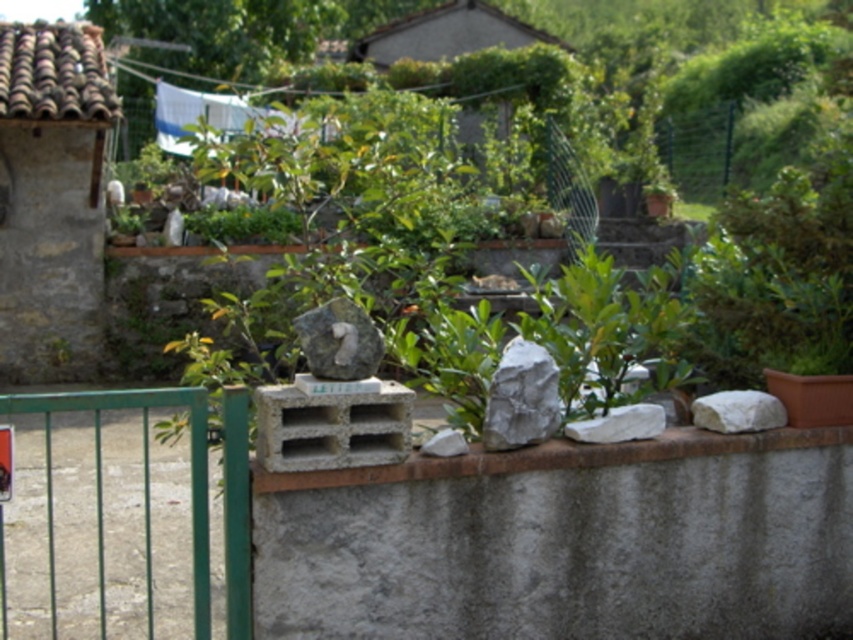
You are designing a garden path and need to place two white smooth rocks. The white smooth rock at right and the white smooth rock at center are available. Which rock should you choose if you want the larger one for a focal point?

The white smooth rock at right is larger compared to the white smooth rock at center, so it should be chosen as the focal point.

You are standing in the garden and see the gray concrete crate at center and the white matte rock at center. Which object is located to the right of the other?

The gray concrete crate at center is positioned on the left side of white matte rock at center, so the white matte rock at center is to the right of the gray concrete crate at center.

You are a gardener trying to place a new plant in the center of this garden area. You have two options for placement spots based on the image. The first spot is near the gray concrete crate at center, and the second is near the white matte rock at center. Which spot is higher in elevation?

The gray concrete crate at center is positioned over the white matte rock at center, so the spot near the gray concrete crate at center is higher in elevation.